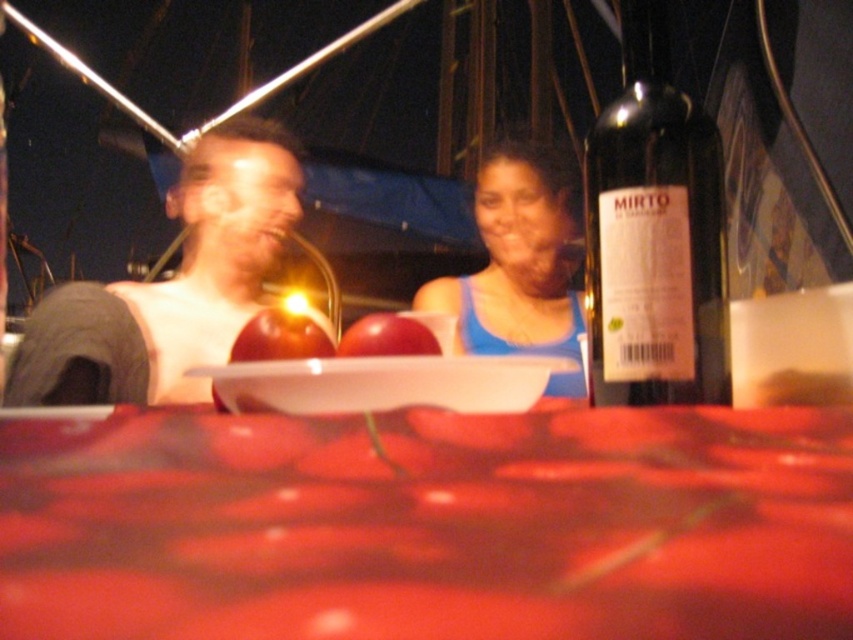
Does shiny red apple at center appear over glossy apple at center?

Indeed, shiny red apple at center is positioned over glossy apple at center.

Is shiny red apple at center below glossy apple at center?

No.

Between point (265, 314) and point (410, 339), which one is positioned in front?

Positioned in front is point (410, 339).

Identify the location of shiny red apple at center. (280, 337).

Does smooth red fabric at center appear under dark glass bottle at upper right?

Yes, smooth red fabric at center is below dark glass bottle at upper right.

Identify the location of smooth red fabric at center. The width and height of the screenshot is (853, 640). (428, 525).

In the scene shown: Can you confirm if smooth red fabric at center is smaller than white glossy plate at center?

Incorrect, smooth red fabric at center is not smaller in size than white glossy plate at center.

Is smooth red fabric at center to the left of white glossy plate at center from the viewer's perspective?

Incorrect, smooth red fabric at center is not on the left side of white glossy plate at center.

Between point (747, 576) and point (370, 394), which one is positioned in front?

Point (747, 576) is more forward.

I want to click on smooth red fabric at center, so click(428, 525).